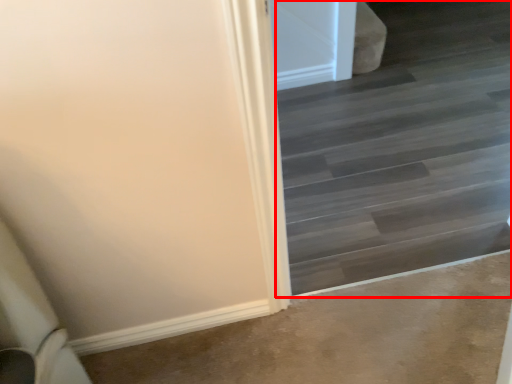
Question: From the image, what is the correct spatial relationship of stairwell (annotated by the red box) in relation to concrete?

Choices:
 (A) left
 (B) right

Answer: (B)